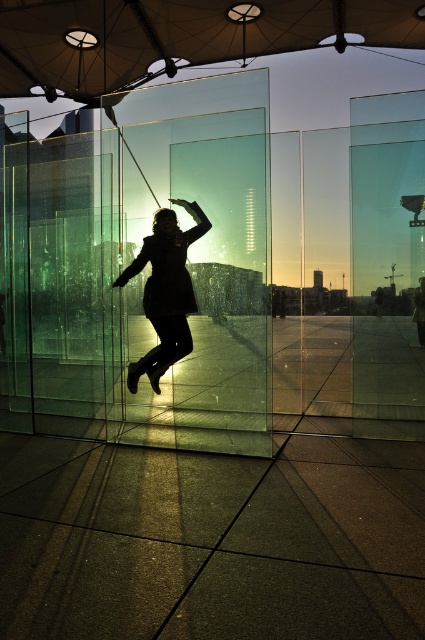
Question: In this image, where is transparent fabric umbrella at upper center located relative to black matte coat at center?

Choices:
 (A) left
 (B) right

Answer: (A)

Question: Which of the following is the farthest from the observer?

Choices:
 (A) transparent fabric umbrella at upper center
 (B) black matte coat at center

Answer: (A)

Question: Is transparent fabric umbrella at upper center wider than black matte coat at center?

Choices:
 (A) no
 (B) yes

Answer: (B)

Question: Among these objects, which one is nearest to the camera?

Choices:
 (A) black matte coat at center
 (B) transparent fabric umbrella at upper center

Answer: (A)

Question: Is transparent fabric umbrella at upper center behind black matte coat at center?

Choices:
 (A) no
 (B) yes

Answer: (B)